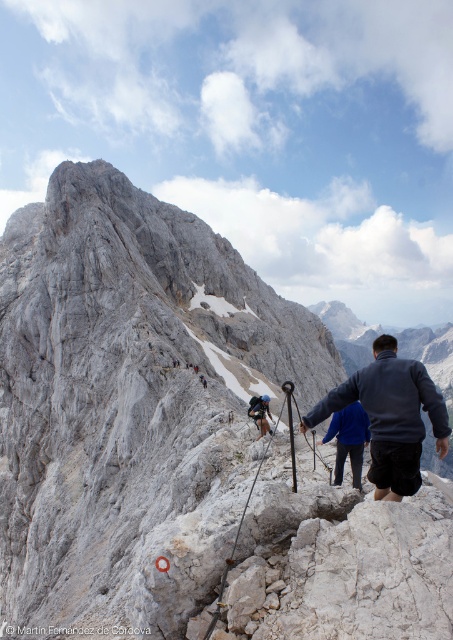
You are a hiker planning to join the group. You see two hikers wearing dark gray jacket at center and dark blue jacket at center. Which hiker is standing to the right when viewed from your perspective?

The dark gray jacket at center is positioned on the right side of dark blue jacket at center, so the hiker wearing the dark gray jacket at center is standing to the right.

You are a hiker planning to join the group in the image. You have a backpack that is 40 cm wide. Can you determine if the backpack will fit between the dark gray jacket at center and the dark blue jacket at center?

The dark gray jacket at center is wider than the dark blue jacket at center. However, the exact distance between them isn not provided, so it is unclear if the 40 cm backpack will fit. More information is needed about the space between the two jackets.